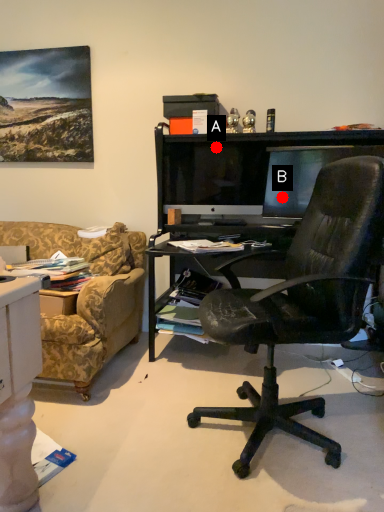
Question: Two points are circled on the image, labeled by A and B beside each circle. Which point appears closest to the camera in this image?

Choices:
 (A) A is closer
 (B) B is closer

Answer: (A)